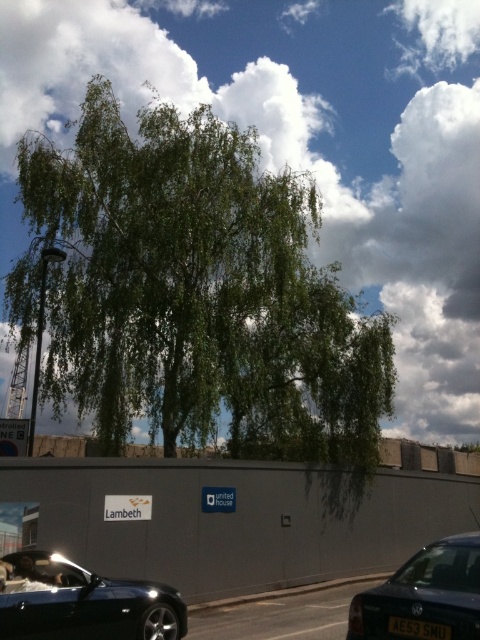
Does green leafy tree at center have a lesser height compared to shiny black car at lower left?

No, green leafy tree at center is not shorter than shiny black car at lower left.

Which is below, green leafy tree at center or shiny black car at lower left?

shiny black car at lower left is below.

Locate an element on the screen. green leafy tree at center is located at coordinates (199, 292).

The height and width of the screenshot is (640, 480). Identify the location of shiny black car at lower left. (84, 602).

Which is behind, point (37, 582) or point (454, 577)?

The point (37, 582) is more distant.

You are a GUI agent. You are given a task and a screenshot of the screen. Output one action in this format:
    pyautogui.click(x=<x>, y=<y>)
    Task: Click on the shiny black car at lower left
    Image resolution: width=480 pixels, height=640 pixels.
    Given the screenshot: What is the action you would take?
    pyautogui.click(x=84, y=602)

At what (x,y) coordinates should I click in order to perform the action: click on shiny black car at lower left. Please return your answer as a coordinate pair (x, y). This screenshot has height=640, width=480. Looking at the image, I should click on point(84,602).

Does shiny black car at lower left have a lesser height compared to black plastic license plate at center?

Incorrect, shiny black car at lower left's height does not fall short of black plastic license plate at center's.

How distant is shiny black car at lower left from black plastic license plate at center?

shiny black car at lower left and black plastic license plate at center are 3.42 meters apart from each other.

I want to click on shiny black car at lower left, so click(84, 602).

This screenshot has width=480, height=640. What are the coordinates of `shiny black car at lower left` in the screenshot? It's located at (84, 602).